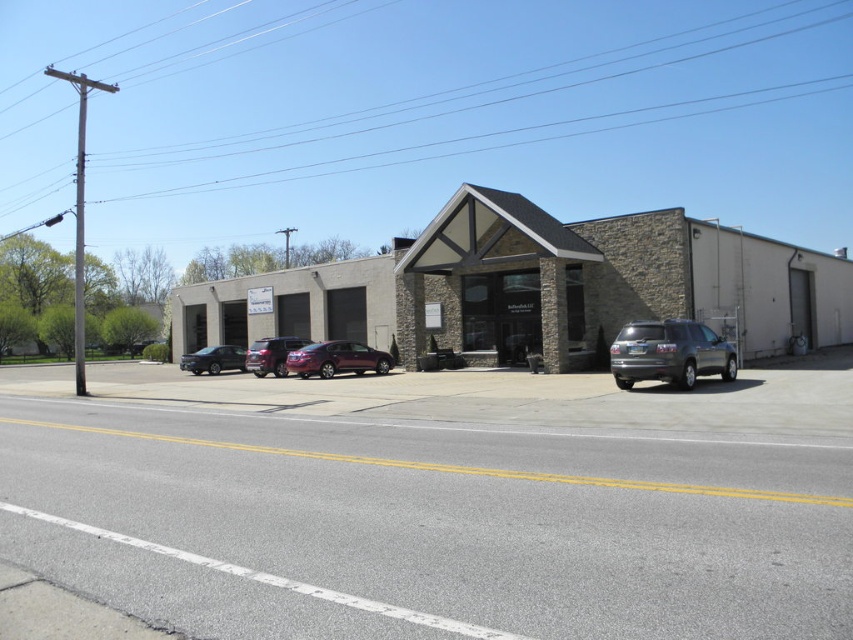
You are a delivery person trying to park your van which is 2 meters wide. You see the satin silver suv at right and the satin black sedan at center in the parking lot. Which parking spot between these two vehicles can accommodate your van?

The satin silver suv at right is thinner than the satin black sedan at center, so the space between the satin black sedan at center and the satin silver suv at right is wider than 2 meters. Therefore, the van can fit in that space.

You are a delivery driver who needs to park your delivery van, which is 6 meters long, in the parking lot. There is space between the metallic purple sedan at center and the satin black sedan at center. Can your van fit in that space?

The metallic purple sedan at center is smaller than the satin black sedan at center, but the exact distance between them isn not provided. Therefore, it is uncertain if the 6 meter van can fit in the space between them.